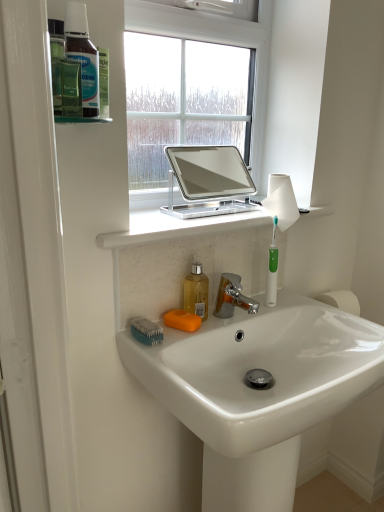
Question: Can you confirm if orange matte soap at sink is smaller than teal plastic brush at lower left?

Choices:
 (A) yes
 (B) no

Answer: (A)

Question: From a real-world perspective, is orange matte soap at sink on teal plastic brush at lower left?

Choices:
 (A) no
 (B) yes

Answer: (A)

Question: From a real-world perspective, is orange matte soap at sink positioned under teal plastic brush at lower left based on gravity?

Choices:
 (A) no
 (B) yes

Answer: (B)

Question: Is orange matte soap at sink at the right side of teal plastic brush at lower left?

Choices:
 (A) yes
 (B) no

Answer: (A)

Question: Is orange matte soap at sink not inside teal plastic brush at lower left?

Choices:
 (A) yes
 (B) no

Answer: (A)

Question: Is orange matte soap at sink in front of teal plastic brush at lower left?

Choices:
 (A) no
 (B) yes

Answer: (A)

Question: Considering the relative sizes of white glossy sink at center and orange matte soap at sink in the image provided, is white glossy sink at center smaller than orange matte soap at sink?

Choices:
 (A) no
 (B) yes

Answer: (A)

Question: Considering the relative positions of white glossy sink at center and orange matte soap at sink in the image provided, is white glossy sink at center to the left of orange matte soap at sink from the viewer's perspective?

Choices:
 (A) yes
 (B) no

Answer: (B)

Question: Is white glossy sink at center to the right of orange matte soap at sink from the viewer's perspective?

Choices:
 (A) no
 (B) yes

Answer: (B)

Question: From a real-world perspective, is white glossy sink at center beneath orange matte soap at sink?

Choices:
 (A) yes
 (B) no

Answer: (A)

Question: Does white glossy sink at center lie in front of orange matte soap at sink?

Choices:
 (A) yes
 (B) no

Answer: (A)

Question: Could you tell me if white glossy sink at center is turned towards orange matte soap at sink?

Choices:
 (A) no
 (B) yes

Answer: (A)

Question: Is white glossy sink at center oriented away from green plastic toothbrush at right?

Choices:
 (A) no
 (B) yes

Answer: (A)